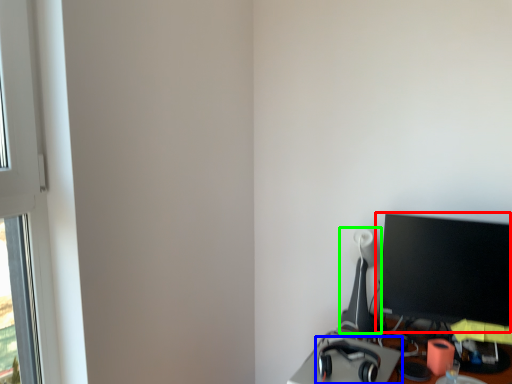
Question: Considering the real-world distances, which object is farthest from computer monitor (highlighted by a red box)? headphones (highlighted by a blue box) or table lamp (highlighted by a green box)?

Choices:
 (A) headphones
 (B) table lamp

Answer: (A)